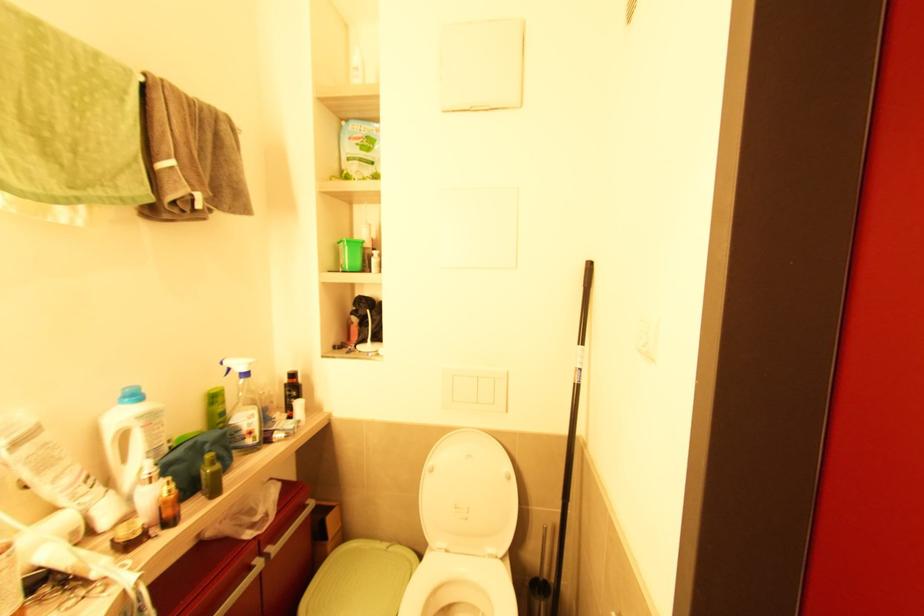
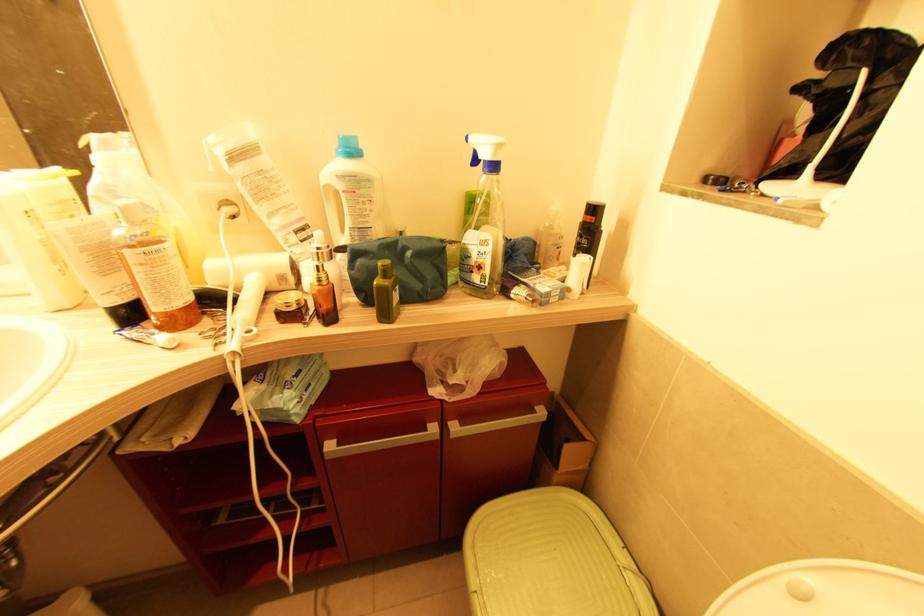
Question: I am providing you with two images of the same scene from different viewpoints. Please identify which objects are invisible in image2.

Choices:
 (A) white bottle handle
 (B) green trash can lid
 (C) green toiletry bag
 (D) none of these

Answer: (D)